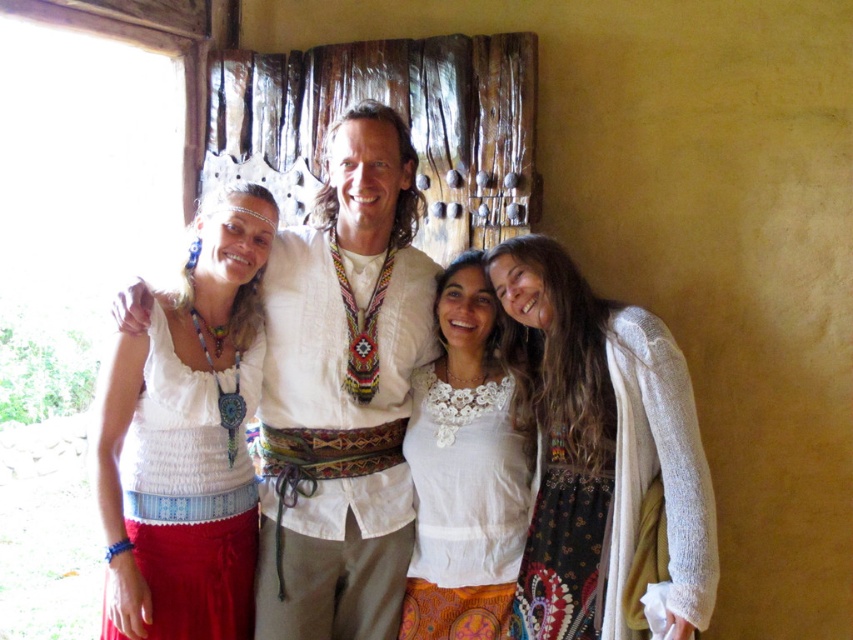
Question: Is white woven shirt at center bigger than white lace blouse at center?

Choices:
 (A) no
 (B) yes

Answer: (B)

Question: Which point is closer to the camera taking this photo?

Choices:
 (A) (177, 394)
 (B) (645, 577)
 (C) (347, 544)
 (D) (422, 634)

Answer: (B)

Question: Estimate the real-world distances between objects in this image. Which object is closer to the white lace blouse at center?

Choices:
 (A) white cotton top at center
 (B) white woven shirt at center

Answer: (B)

Question: Which object is the farthest from the white woven shirt at center?

Choices:
 (A) white textured sweater at right
 (B) white lace blouse at center
 (C) white cotton top at center

Answer: (A)

Question: Does white textured sweater at right come behind white cotton top at center?

Choices:
 (A) no
 (B) yes

Answer: (A)

Question: Does white woven shirt at center have a larger size compared to white cotton top at center?

Choices:
 (A) yes
 (B) no

Answer: (A)